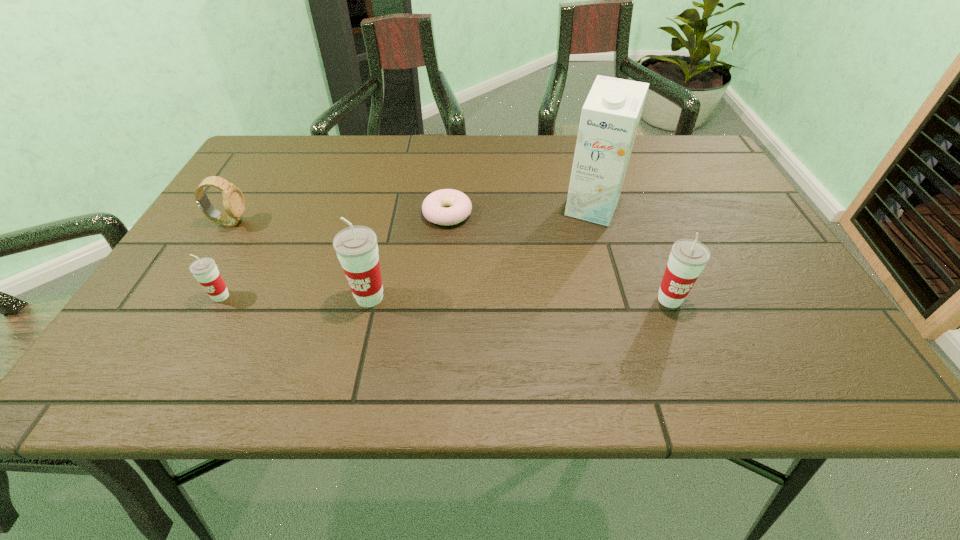
Where is `the leftmost cup`? the leftmost cup is located at coordinates (204, 269).

Locate an element on the screen. This screenshot has height=540, width=960. the fifth object from right to left is located at coordinates (204, 269).

Identify the location of the second cup from left to right. Image resolution: width=960 pixels, height=540 pixels. 356,246.

Locate an element on the screen. The width and height of the screenshot is (960, 540). the rightmost cup is located at coordinates (688, 257).

Find the location of a particular element. The height and width of the screenshot is (540, 960). the fourth shortest object is located at coordinates (688, 257).

The height and width of the screenshot is (540, 960). Identify the location of the second object from right to left. (610, 116).

Where is `the tallest object`? the tallest object is located at coordinates (610, 116).

You are a GUI agent. You are given a task and a screenshot of the screen. Output one action in this format:
    pyautogui.click(x=<x>, y=<y>)
    Task: Click on the doughnut
    This screenshot has height=540, width=960.
    Given the screenshot: What is the action you would take?
    pyautogui.click(x=459, y=204)

Where is `the third object from right to left`? the third object from right to left is located at coordinates (459, 204).

The image size is (960, 540). Find the location of `watch`. watch is located at coordinates (233, 199).